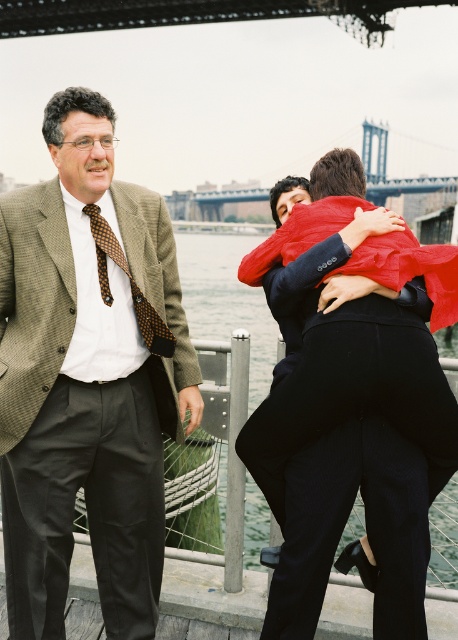
You are standing at the waterfront near a bridge. You want to take a photo of the point at coordinates point [49,376]. If your camera has a maximum focus range of 10 meters, will you be able to focus on that point?

The distance of point [49,376] from viewer is 10.59 meters, which exceeds the camera maximum focus range of 10 meters. So you cannot focus on that point.